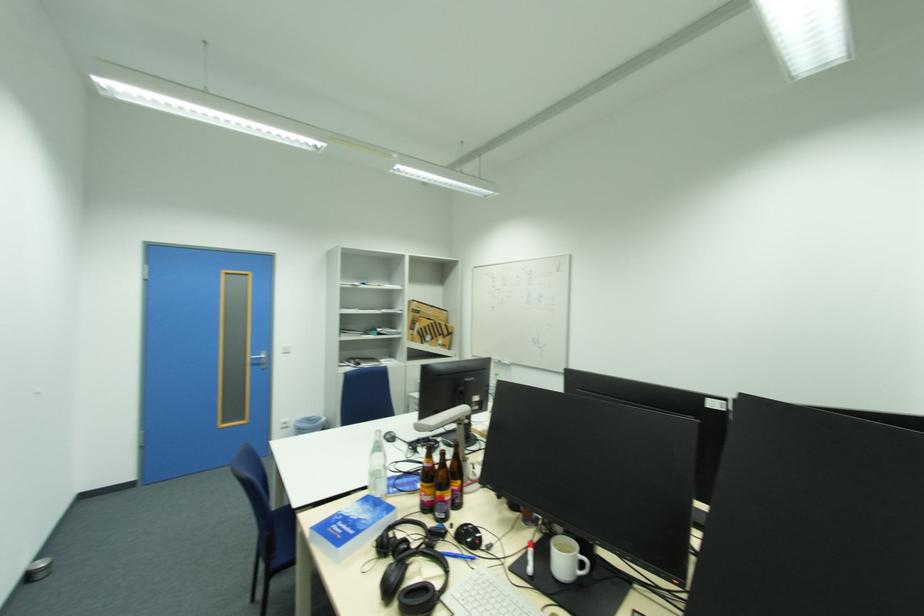
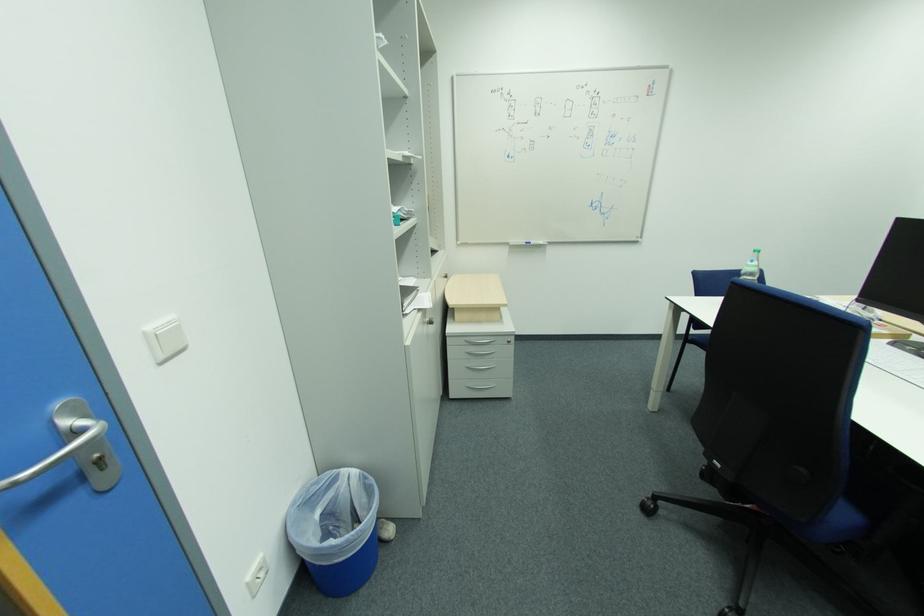
Find the pixel in the second image that matches (x=289, y=347) in the first image.

(154, 329)